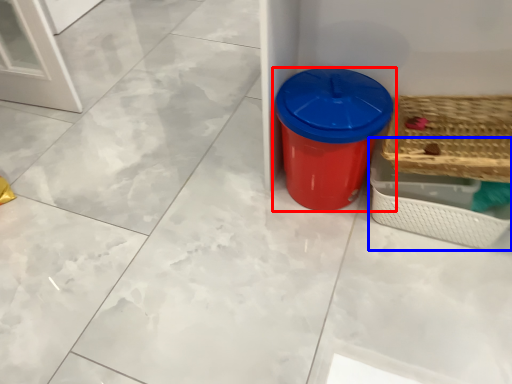
Question: Among these objects, which one is nearest to the camera, waste container (highlighted by a red box) or basket (highlighted by a blue box)?

Choices:
 (A) waste container
 (B) basket

Answer: (A)